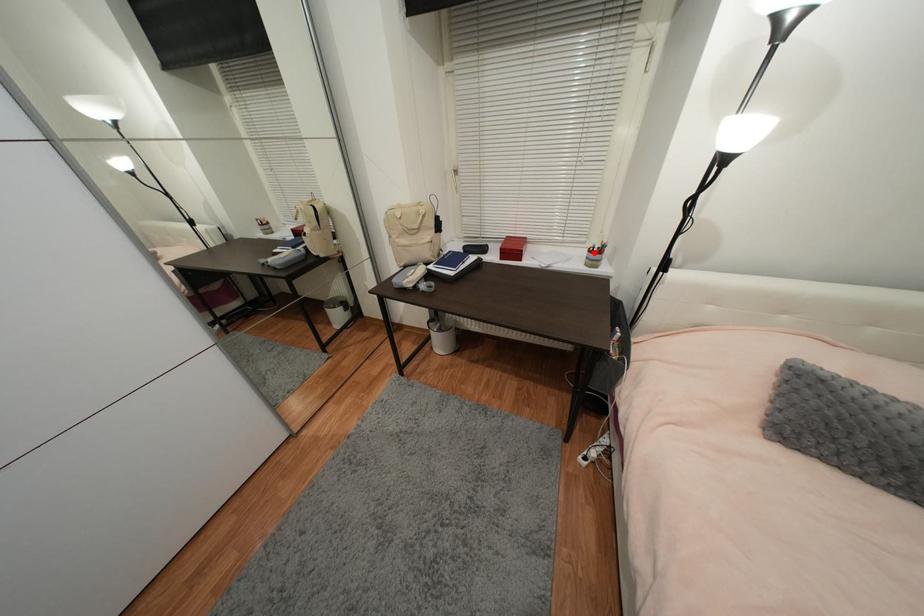
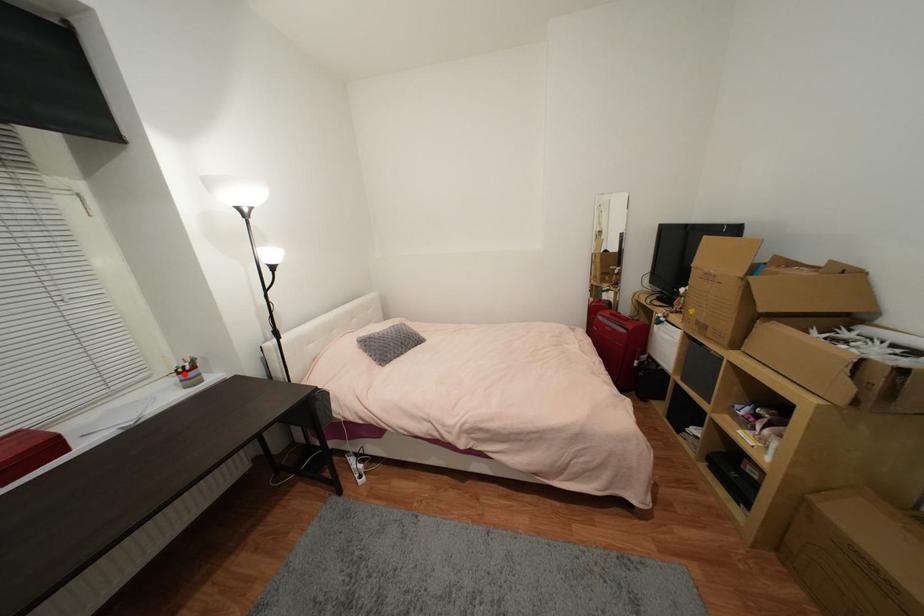
I am providing you with two images of the same scene from different viewpoints. A red point is marked on the first image and another point is marked on the second image. Does the point marked in image1 correspond to the same location as the one in image2?

Yes